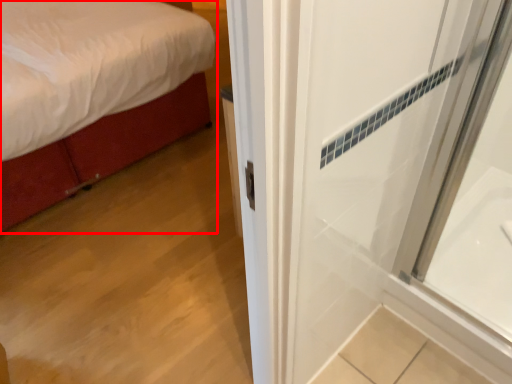
Question: From the image's perspective, where is bed (annotated by the red box) located in relation to bath in the image?

Choices:
 (A) below
 (B) above

Answer: (B)